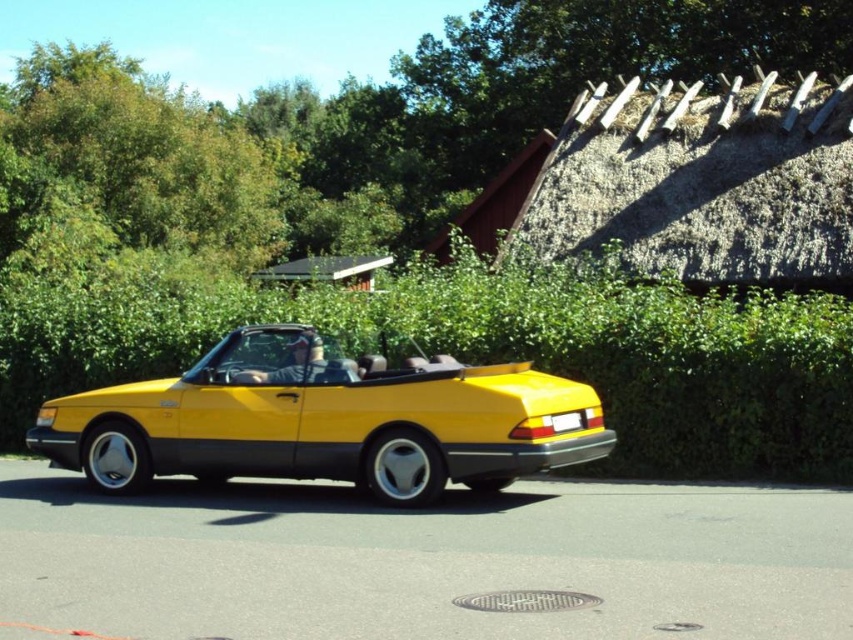
Question: Which point is closer to the camera?

Choices:
 (A) yellow matte convertible at center
 (B) wooden thatched hut at upper center

Answer: (A)

Question: Does yellow matte convertible at center appear on the right side of wooden thatched hut at upper center?

Choices:
 (A) yes
 (B) no

Answer: (B)

Question: From the image, what is the correct spatial relationship of green leafy hedge at center in relation to yellow matte convertible at center?

Choices:
 (A) left
 (B) right

Answer: (B)

Question: Which object is positioned farthest from the green leafy hedge at center?

Choices:
 (A) thatched straw roof at upper right
 (B) wooden thatched hut at upper center
 (C) yellow matte convertible at center

Answer: (B)

Question: Which of these objects is positioned farthest from the yellow matte convertible at center?

Choices:
 (A) green leafy hedge at center
 (B) thatched straw roof at upper right

Answer: (B)

Question: Can you confirm if yellow matte convertible at center is smaller than wooden thatched hut at upper center?

Choices:
 (A) no
 (B) yes

Answer: (B)